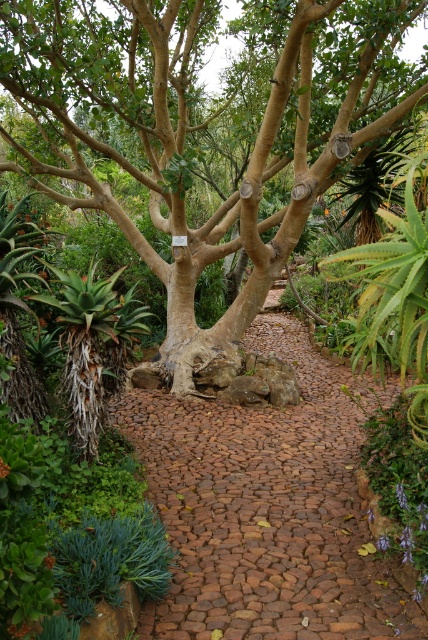
Where is the brown textured tree at center located in the image?

The brown textured tree at center is located at point (201, 128) in the image.

You are standing in the garden and see two points marked in the scene. The first point is at coordinates point [2,67] and the second is at point [320,540]. Which point is closer to you?

Point [2,67] is further to the viewer than point [320,540], so the second point is closer to you.